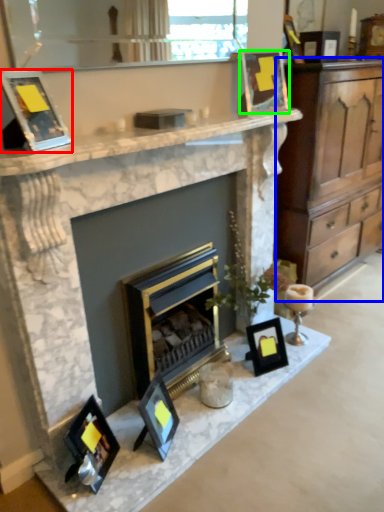
Question: Based on their relative distances, which object is farther from picture frame (highlighted by a red box)? Choose from cabinetry (highlighted by a blue box) and picture frame (highlighted by a green box).

Choices:
 (A) cabinetry
 (B) picture frame

Answer: (A)